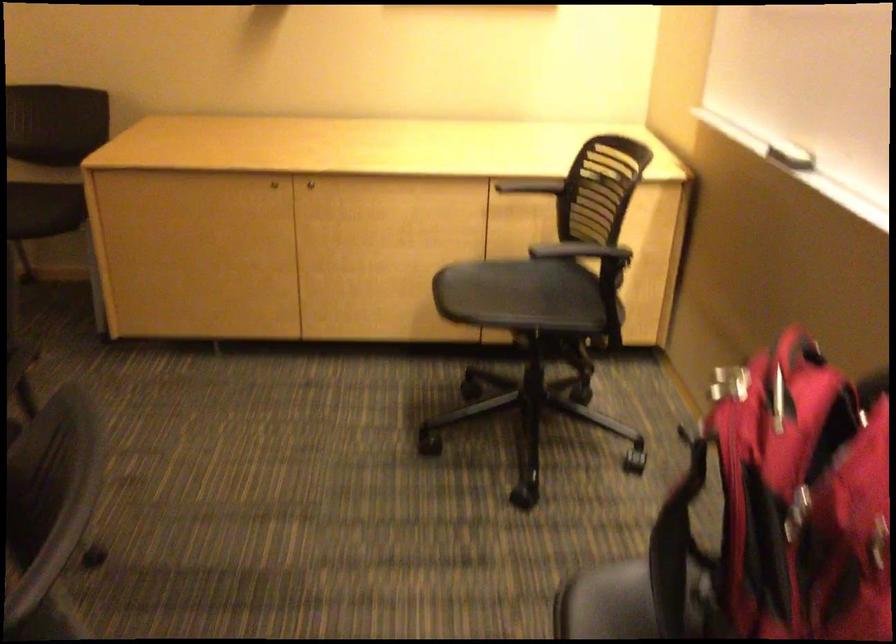
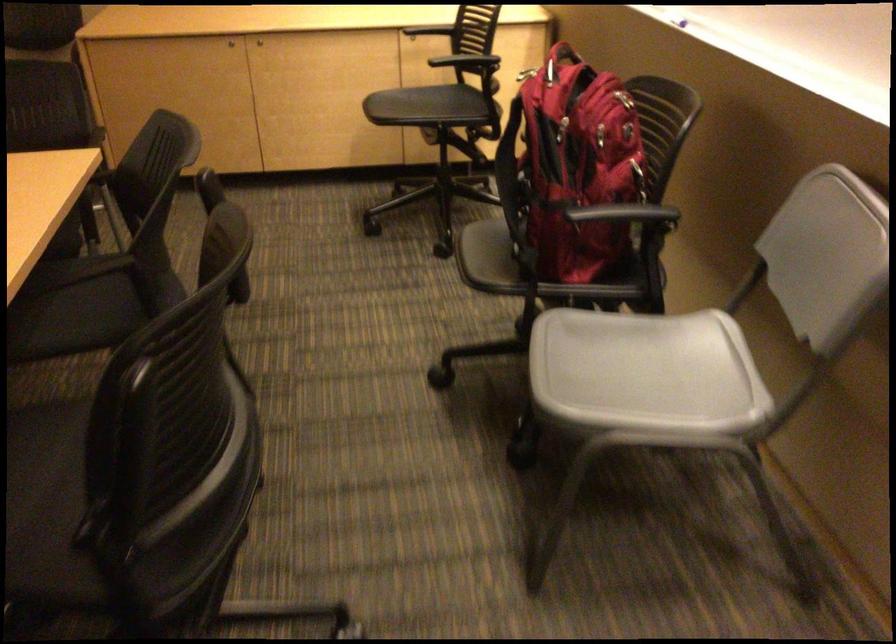
Where in the second image is the point corresponding to point (314, 194) from the first image?

(259, 41)